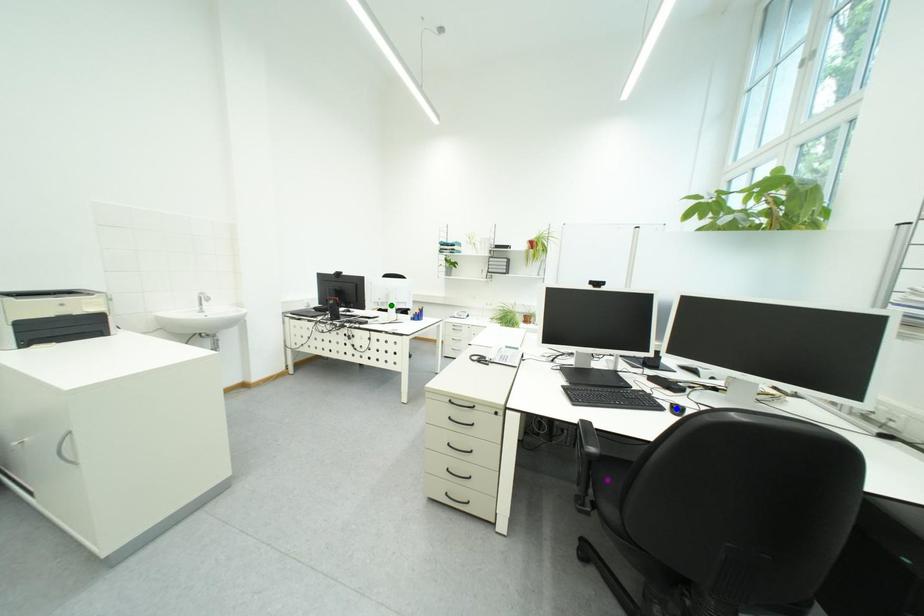
Order these from nearest to farthest:
purple point, blue point, green point

purple point
blue point
green point